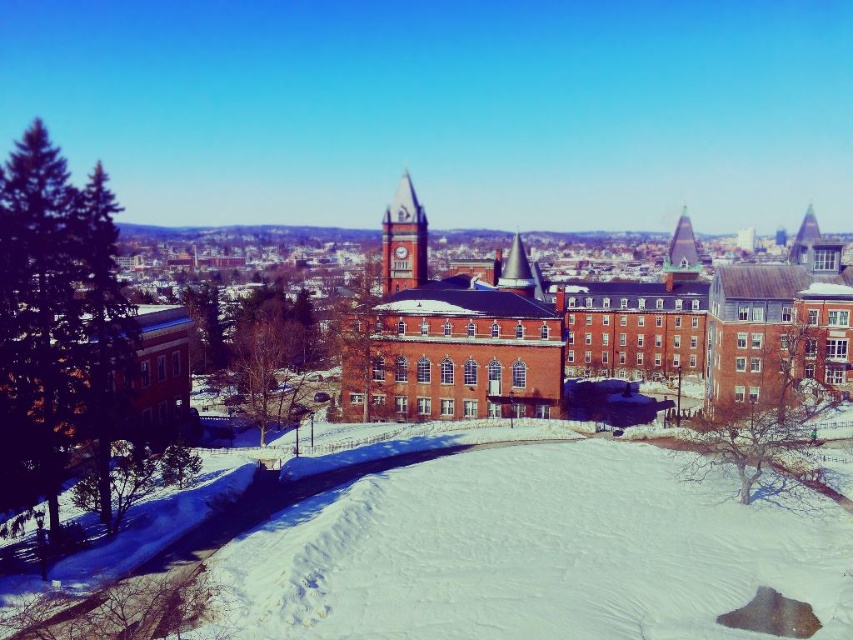
Is matte brick clock tower at center below smooth glass pyramid at upper right?

Correct, matte brick clock tower at center is located below smooth glass pyramid at upper right.

Does matte brick clock tower at center have a lesser height compared to smooth glass pyramid at upper right?

Correct, matte brick clock tower at center is not as tall as smooth glass pyramid at upper right.

In order to click on matte brick clock tower at center in this screenshot , I will do `click(403, 241)`.

I want to click on matte brick clock tower at center, so click(403, 241).

Which is above, matte brick clock tower at center or smooth gray spire at center?

matte brick clock tower at center is above.

Is point (405, 284) closer to viewer compared to point (521, 275)?

No, it is not.

Image resolution: width=853 pixels, height=640 pixels. Describe the element at coordinates (403, 241) in the screenshot. I see `matte brick clock tower at center` at that location.

The height and width of the screenshot is (640, 853). I want to click on matte brick clock tower at center, so click(403, 241).

Can you confirm if smooth glass pyramid at upper right is positioned to the right of smooth gray spire at center?

Yes, smooth glass pyramid at upper right is to the right of smooth gray spire at center.

Who is higher up, smooth glass pyramid at upper right or smooth gray spire at center?

smooth glass pyramid at upper right is above.

The image size is (853, 640). What do you see at coordinates (682, 252) in the screenshot?
I see `smooth glass pyramid at upper right` at bounding box center [682, 252].

I want to click on smooth glass pyramid at upper right, so click(x=682, y=252).